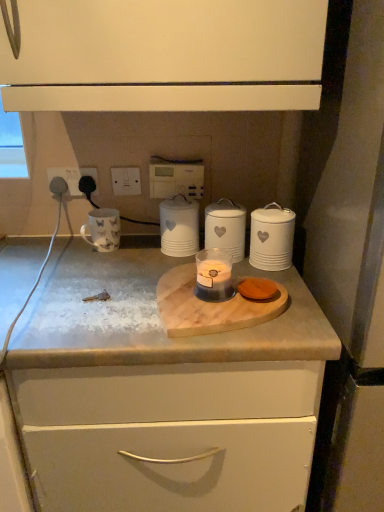
Where is `vacant space that's between white matte canister at center, which is the first home appliance in left-to-right order, and white glossy mug at left`? This screenshot has height=512, width=384. vacant space that's between white matte canister at center, which is the first home appliance in left-to-right order, and white glossy mug at left is located at coordinates (137, 251).